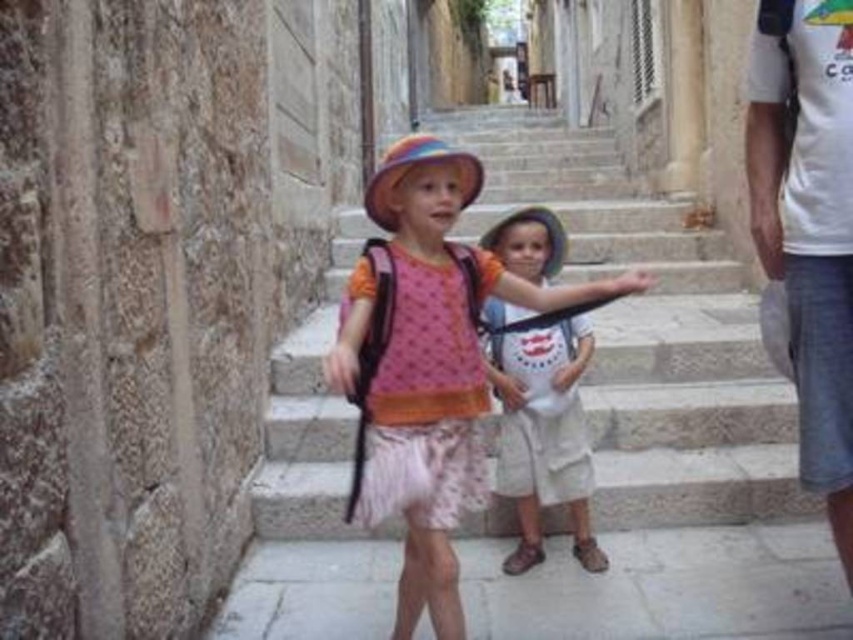
Question: Is stone stairs at center below pink fabric dress at center?

Choices:
 (A) yes
 (B) no

Answer: (B)

Question: Which object appears closest to the camera in this image?

Choices:
 (A) rough stone wall at left
 (B) pink fabric dress at center
 (C) white t-shirt at upper right
 (D) stone stairs at center

Answer: (A)

Question: Which is nearer to the pink fabric dress at center?

Choices:
 (A) white t-shirt at upper right
 (B) white cotton shirt at center
 (C) stone stairs at center
 (D) rough stone wall at left

Answer: (B)

Question: Among these objects, which one is farthest from the camera?

Choices:
 (A) pink fabric dress at center
 (B) white t-shirt at upper right

Answer: (A)

Question: Does stone stairs at center appear on the right side of white t-shirt at upper right?

Choices:
 (A) yes
 (B) no

Answer: (B)

Question: Is rough stone wall at left in front of pink fabric dress at center?

Choices:
 (A) yes
 (B) no

Answer: (A)